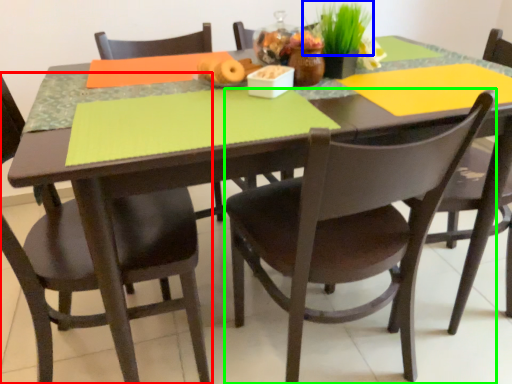
Question: Based on their relative distances, which object is farther from chair (highlighted by a red box)? Choose from plant (highlighted by a blue box) and chair (highlighted by a green box).

Choices:
 (A) plant
 (B) chair

Answer: (A)